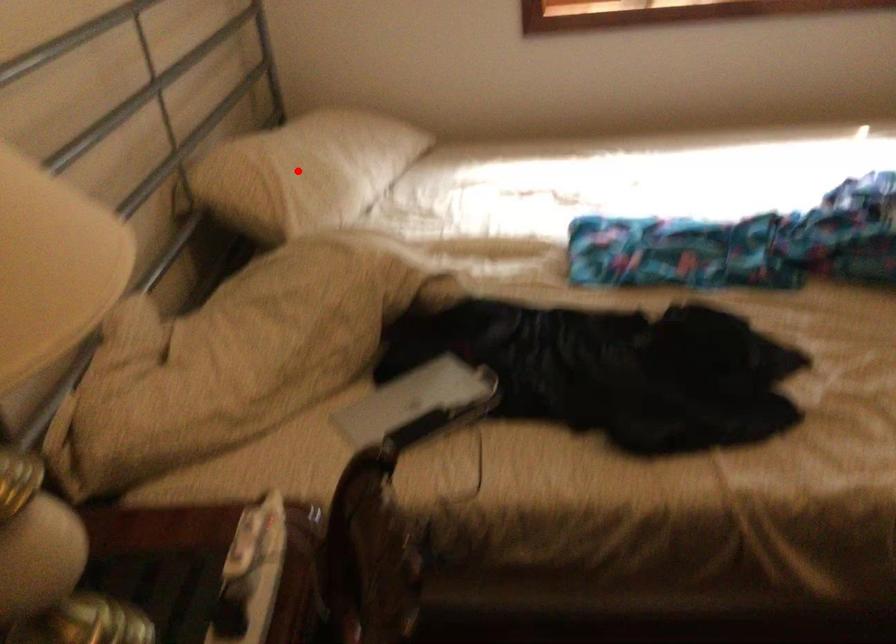
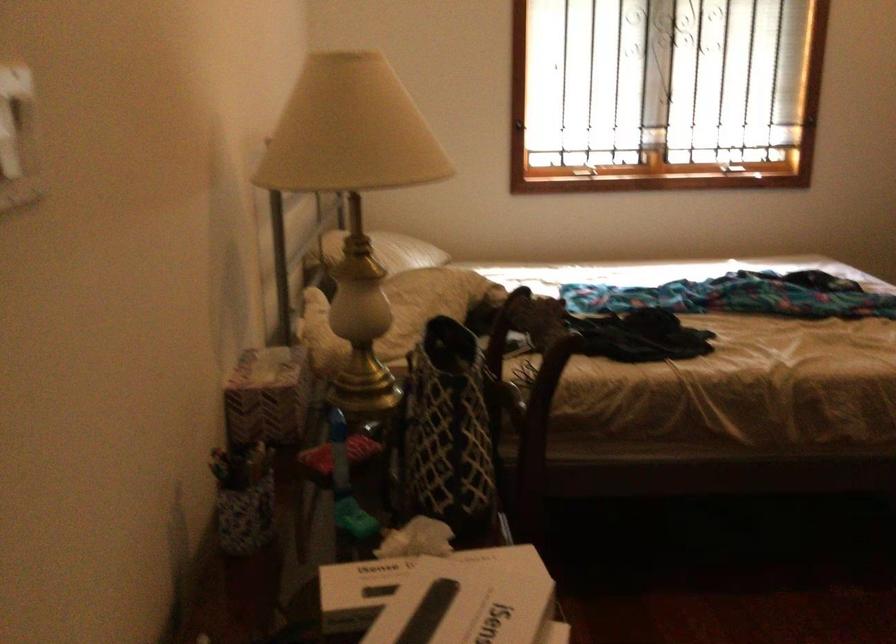
Locate, in the second image, the point that corresponds to the highlighted location in the first image.

(388, 251)